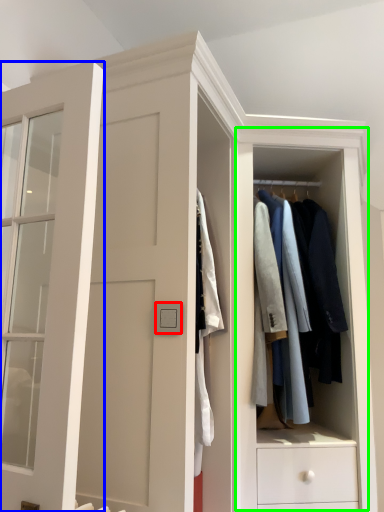
Question: Based on their relative distances, which object is farther from light switch (highlighted by a red box)? Choose from door (highlighted by a blue box) and dresser (highlighted by a green box).

Choices:
 (A) door
 (B) dresser

Answer: (B)